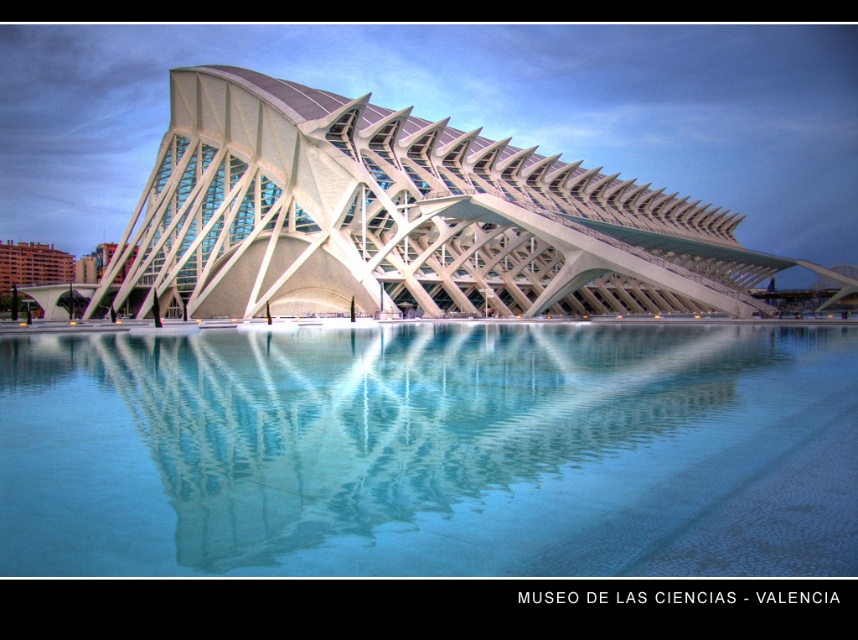
Question: Is clear glass water at center behind white glass building at center?

Choices:
 (A) no
 (B) yes

Answer: (A)

Question: Can you confirm if clear glass water at center is positioned above white glass building at center?

Choices:
 (A) yes
 (B) no

Answer: (B)

Question: Among these objects, which one is nearest to the camera?

Choices:
 (A) clear glass water at center
 (B) white glass building at center

Answer: (A)

Question: Is clear glass water at center thinner than white glass building at center?

Choices:
 (A) no
 (B) yes

Answer: (B)